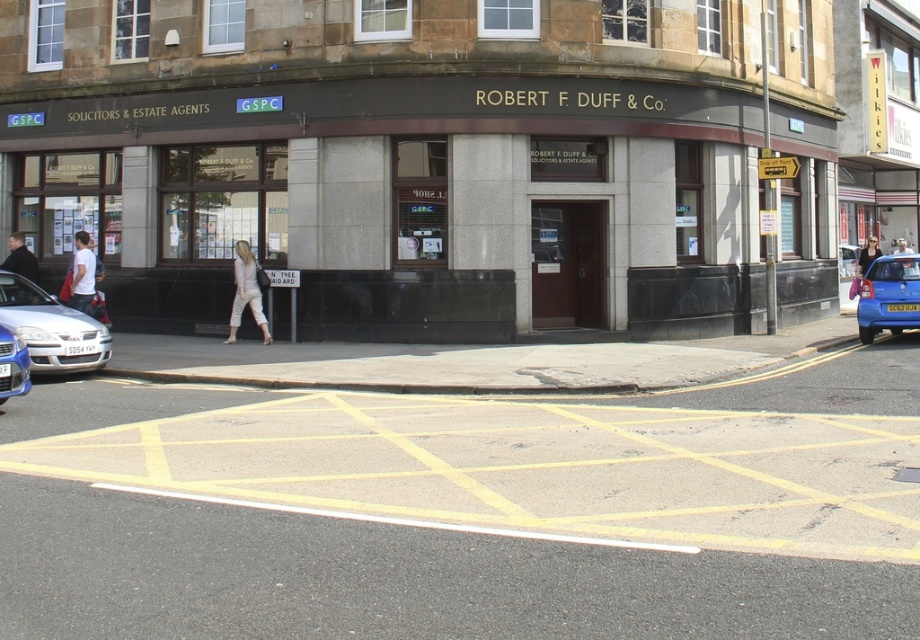
Question: Which object is farther from the camera taking this photo?

Choices:
 (A) matte gray building at center
 (B) silver metallic car at lower left

Answer: (A)

Question: Does metallic blue sedan at lower left appear on the right side of light brown leather jacket at upper center?

Choices:
 (A) yes
 (B) no

Answer: (B)

Question: Is silver metallic car at lower left further to the viewer compared to light brown leather jacket at upper center?

Choices:
 (A) yes
 (B) no

Answer: (B)

Question: Among these objects, which one is farthest from the camera?

Choices:
 (A) white cotton shirt at left
 (B) silver metallic car at lower left
 (C) light beige pants at center
 (D) dark blue jacket at left

Answer: (D)

Question: Among these points, which one is nearest to the camera?

Choices:
 (A) (870, 253)
 (B) (907, 275)
 (C) (230, 321)
 (D) (466, 272)

Answer: (D)

Question: Can you confirm if silver metallic car at lower left is positioned to the left of blue metallic hatchback at right?

Choices:
 (A) no
 (B) yes

Answer: (B)